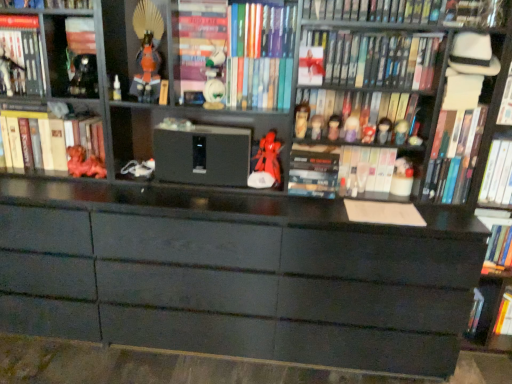
Question: Does matte black figurine at center, which is counted as the seventh toy, starting from the right, lie behind matte red figurine at upper center, the ninth toy in the left-to-right sequence?

Choices:
 (A) yes
 (B) no

Answer: (A)

Question: Can you confirm if matte black figurine at center, which ranks as the tenth toy in left-to-right order, is positioned to the left of matte red figurine at upper center, the ninth toy in the left-to-right sequence?

Choices:
 (A) yes
 (B) no

Answer: (B)

Question: Does matte black figurine at center, which is counted as the seventh toy, starting from the right, have a larger size compared to matte red figurine at upper center, the 8th toy viewed from the right?

Choices:
 (A) no
 (B) yes

Answer: (B)

Question: Is matte black figurine at center, which ranks as the tenth toy in left-to-right order, facing away from matte red figurine at upper center, the 8th toy viewed from the right?

Choices:
 (A) yes
 (B) no

Answer: (B)

Question: From a real-world perspective, is matte black figurine at center, which is counted as the seventh toy, starting from the right, on matte red figurine at upper center, the 8th toy viewed from the right?

Choices:
 (A) yes
 (B) no

Answer: (B)

Question: Considering the relative sizes of matte black figurine at center, which ranks as the tenth toy in left-to-right order, and matte red figurine at upper center, the ninth toy in the left-to-right sequence, in the image provided, is matte black figurine at center, which ranks as the tenth toy in left-to-right order, wider than matte red figurine at upper center, the ninth toy in the left-to-right sequence,?

Choices:
 (A) no
 (B) yes

Answer: (B)

Question: Is matte plastic figurines at center, the eighth book from the right, oriented towards matte red figurine at center, positioned as the 7th toy in left-to-right order?

Choices:
 (A) no
 (B) yes

Answer: (A)

Question: Is matte plastic figurines at center, the sixth book when ordered from left to right, smaller than matte red figurine at center, which ranks as the 10th toy in right-to-left order?

Choices:
 (A) yes
 (B) no

Answer: (B)

Question: From a real-world perspective, is matte plastic figurines at center, the eighth book from the right, on matte red figurine at center, which ranks as the 10th toy in right-to-left order?

Choices:
 (A) no
 (B) yes

Answer: (B)

Question: Is matte plastic figurines at center, the sixth book when ordered from left to right, to the left of matte red figurine at center, positioned as the 7th toy in left-to-right order, from the viewer's perspective?

Choices:
 (A) yes
 (B) no

Answer: (B)

Question: From the image's perspective, does matte plastic figurines at center, the sixth book when ordered from left to right, appear higher than matte red figurine at center, which ranks as the 10th toy in right-to-left order?

Choices:
 (A) no
 (B) yes

Answer: (B)

Question: From the image's perspective, is matte plastic figurines at center, the eighth book from the right, beneath matte red figurine at center, which ranks as the 10th toy in right-to-left order?

Choices:
 (A) yes
 (B) no

Answer: (B)

Question: Is metallic silver figurine at upper left, the 1th toy viewed from the left, far from matte plastic figurines at center, the eighth book from the right?

Choices:
 (A) yes
 (B) no

Answer: (A)